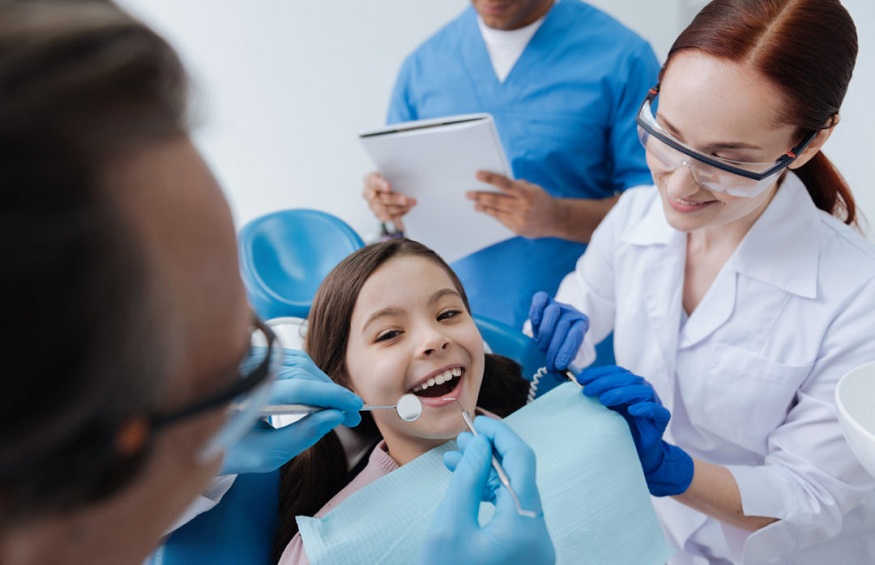
I want to click on chair, so click(x=266, y=216).